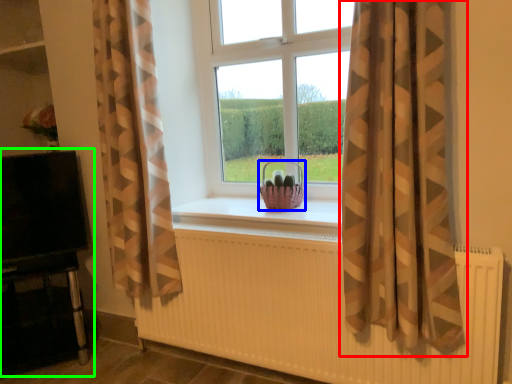
Question: Which object is the farthest from curtain (highlighted by a red box)? Choose among these: basket (highlighted by a blue box) or entertainment center (highlighted by a green box).

Choices:
 (A) basket
 (B) entertainment center

Answer: (B)